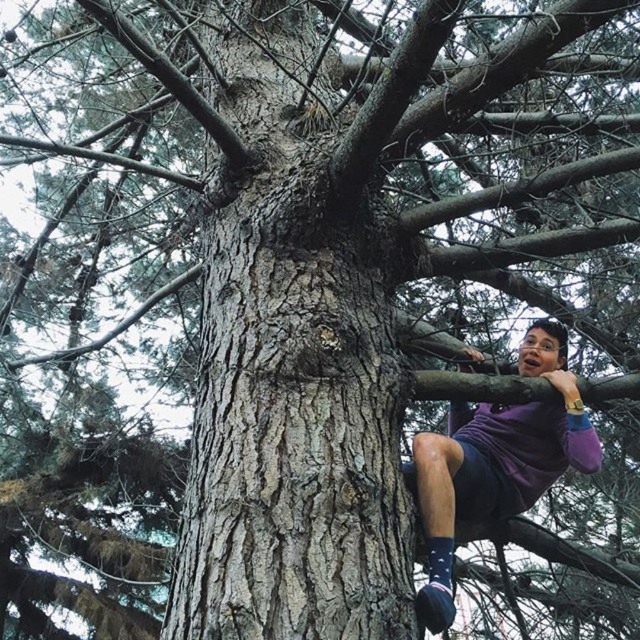
Question: Based on their relative distances, which object is nearer to the purple cotton shirt at right?

Choices:
 (A) blue textured sock at lower right
 (B) smooth bark tree trunk at center

Answer: (A)

Question: Is purple cotton shirt at right behind blue textured sock at lower right?

Choices:
 (A) no
 (B) yes

Answer: (A)

Question: Does purple cotton shirt at right appear on the left side of blue textured sock at lower right?

Choices:
 (A) yes
 (B) no

Answer: (B)

Question: Is purple cotton shirt at right wider than blue textured sock at lower right?

Choices:
 (A) yes
 (B) no

Answer: (A)

Question: Which point appears closest to the camera in this image?

Choices:
 (A) (442, 579)
 (B) (483, 417)
 (C) (308, 440)

Answer: (C)

Question: Which object is closer to the camera taking this photo?

Choices:
 (A) purple cotton shirt at right
 (B) blue textured sock at lower right

Answer: (A)